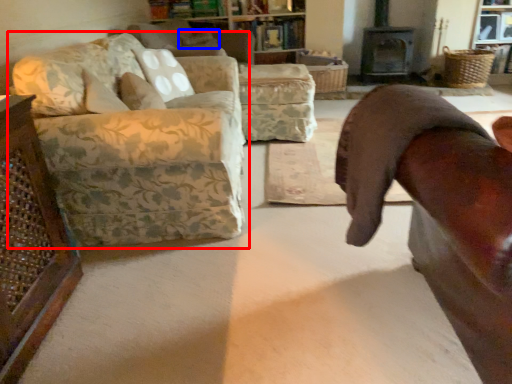
Question: Which of the following is the closest to the observer, studio couch (highlighted by a red box) or pillow (highlighted by a blue box)?

Choices:
 (A) studio couch
 (B) pillow

Answer: (A)